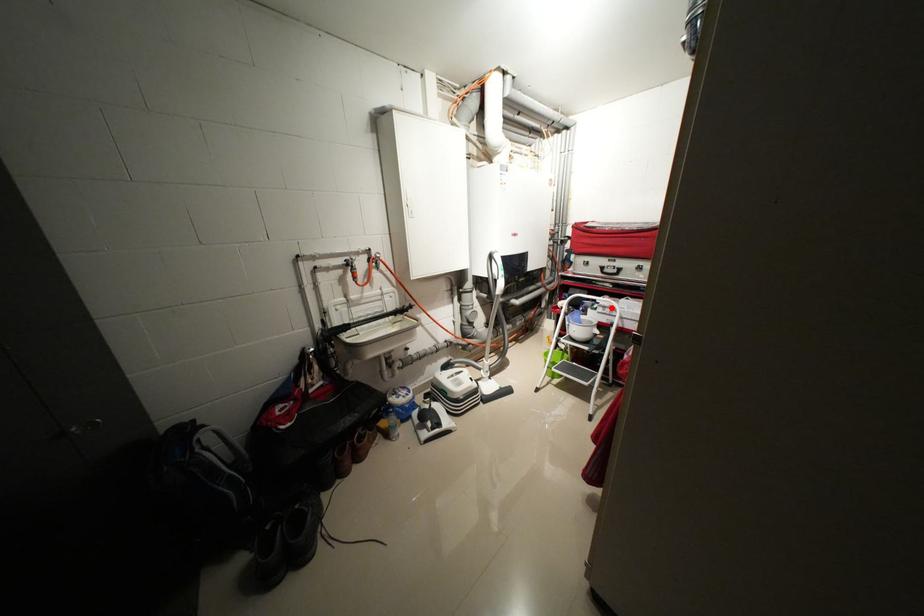
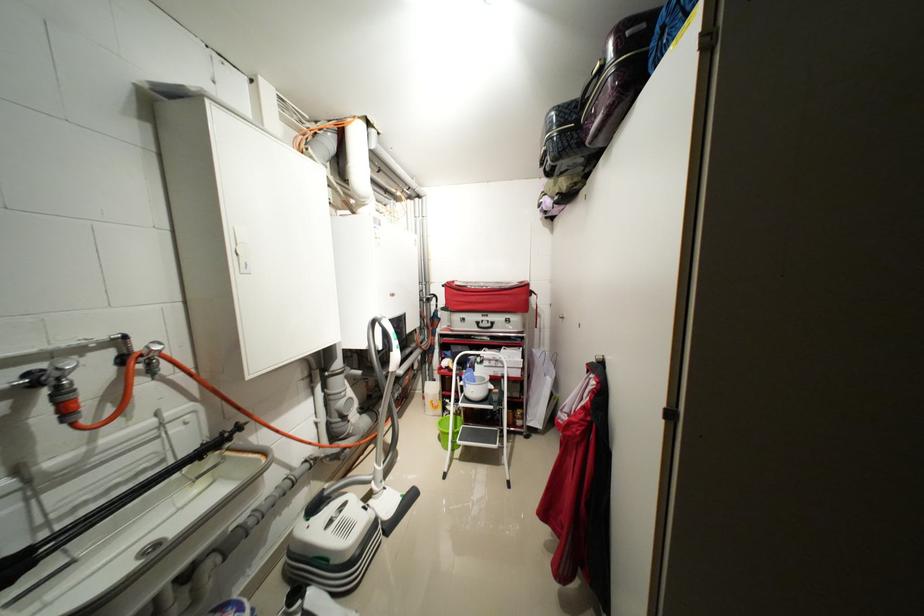
Locate, in the second image, the point that corresponds to the highlighted location in the first image.

(496, 361)